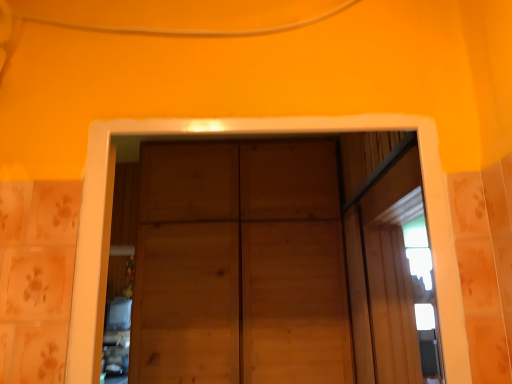
Question: Can you confirm if natural wood door at center is bigger than transparent glass window at center?

Choices:
 (A) yes
 (B) no

Answer: (A)

Question: From the image's perspective, is natural wood door at center over transparent glass window at center?

Choices:
 (A) no
 (B) yes

Answer: (A)

Question: From a real-world perspective, is natural wood door at center under transparent glass window at center?

Choices:
 (A) no
 (B) yes

Answer: (A)

Question: From a real-world perspective, is natural wood door at center over transparent glass window at center?

Choices:
 (A) yes
 (B) no

Answer: (A)

Question: Is natural wood door at center smaller than transparent glass window at center?

Choices:
 (A) yes
 (B) no

Answer: (B)

Question: From the image's perspective, does natural wood door at center appear lower than transparent glass window at center?

Choices:
 (A) yes
 (B) no

Answer: (A)

Question: Considering the relative sizes of transparent glass window at center and natural wood door at center in the image provided, is transparent glass window at center thinner than natural wood door at center?

Choices:
 (A) no
 (B) yes

Answer: (B)

Question: Could you tell me if transparent glass window at center is turned towards natural wood door at center?

Choices:
 (A) no
 (B) yes

Answer: (A)

Question: Considering the relative sizes of transparent glass window at center and natural wood door at center in the image provided, is transparent glass window at center wider than natural wood door at center?

Choices:
 (A) yes
 (B) no

Answer: (B)

Question: From the image's perspective, is transparent glass window at center on top of natural wood door at center?

Choices:
 (A) no
 (B) yes

Answer: (B)

Question: Is transparent glass window at center at the left side of natural wood door at center?

Choices:
 (A) yes
 (B) no

Answer: (B)

Question: Is there a large distance between transparent glass window at center and natural wood door at center?

Choices:
 (A) no
 (B) yes

Answer: (A)

Question: Looking at the image, does natural wood door at center seem bigger or smaller compared to transparent glass window at center?

Choices:
 (A) small
 (B) big

Answer: (B)